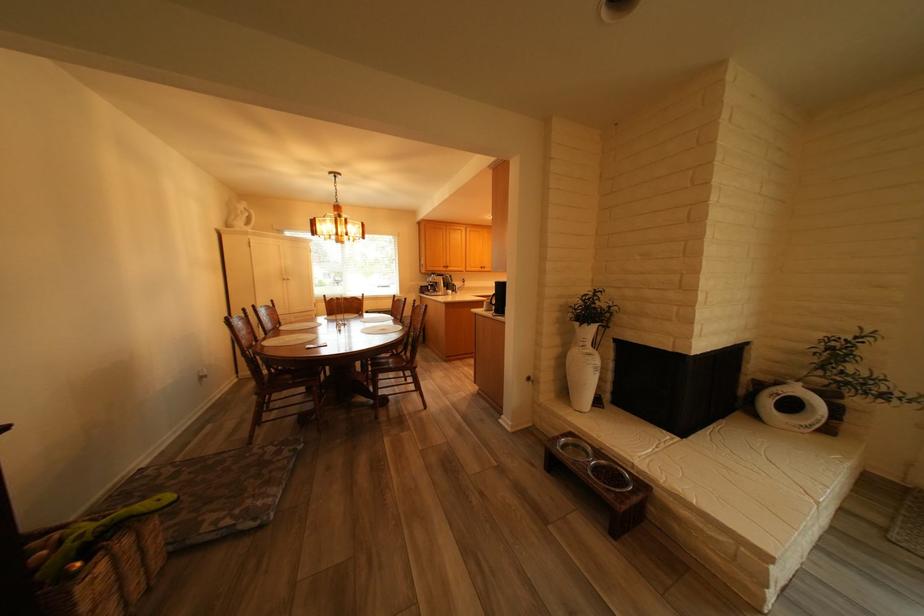
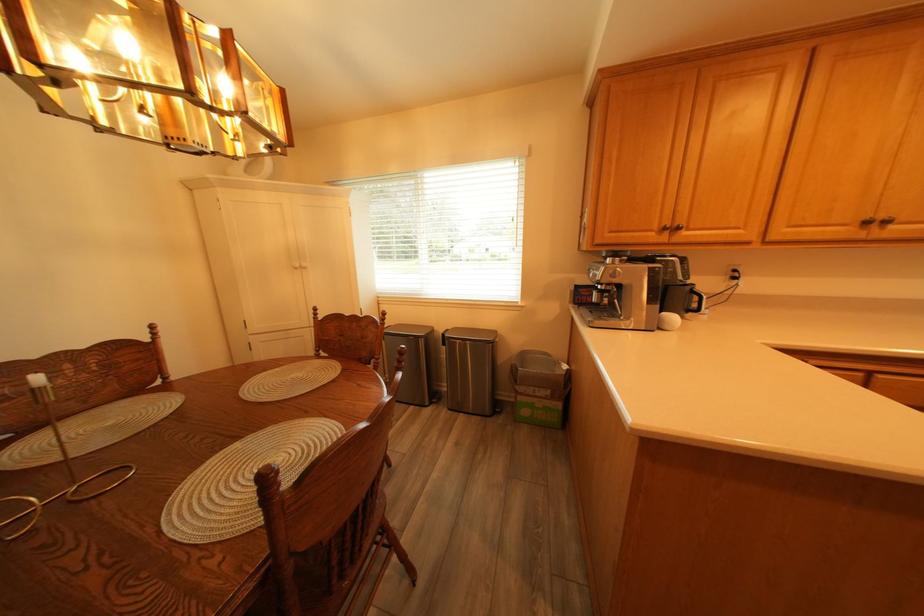
Find the pixel in the second image that matches (444,290) in the first image.

(609, 301)